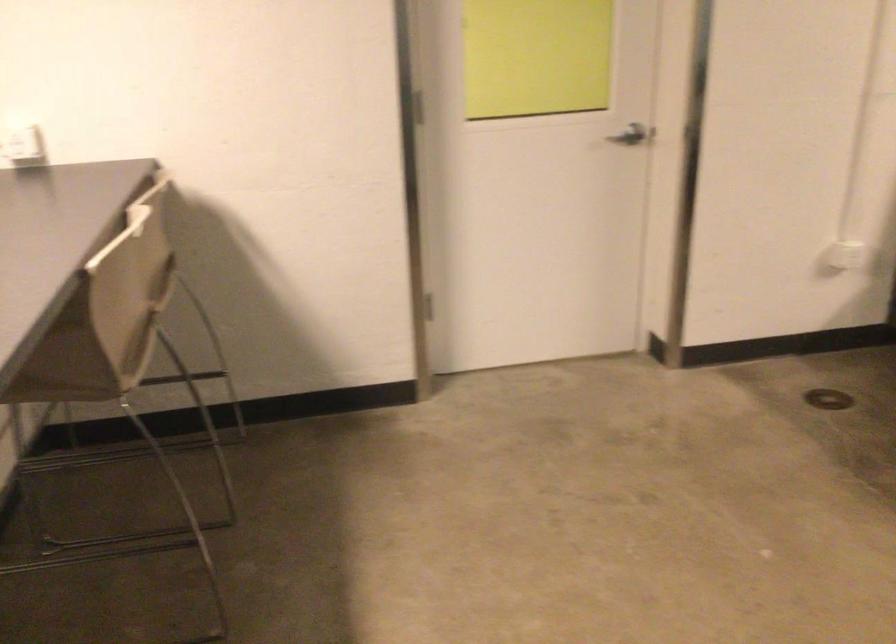
This screenshot has height=644, width=896. What do you see at coordinates (55, 504) in the screenshot?
I see `the chair sitting surface` at bounding box center [55, 504].